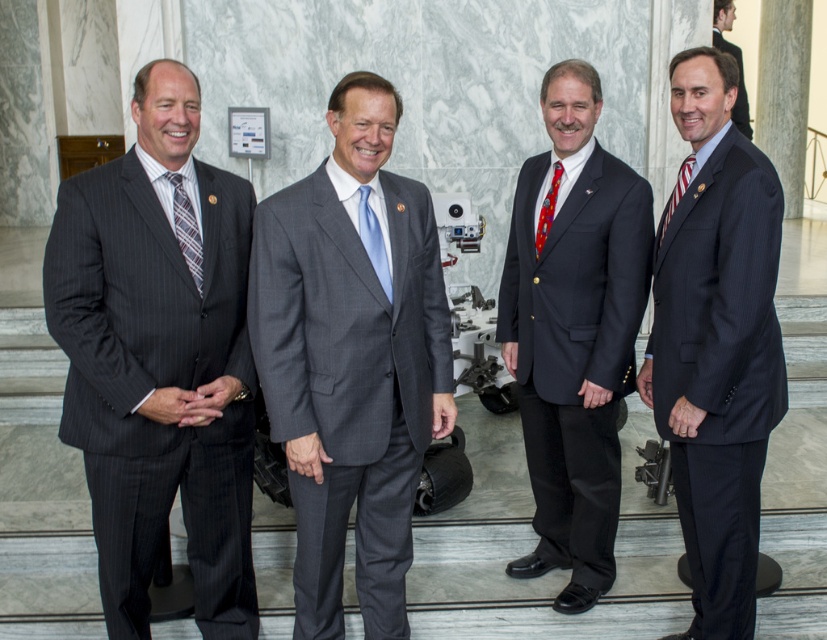
Is gray pinstripe suit at center smaller than light blue silk tie at center?

Incorrect, gray pinstripe suit at center is not smaller in size than light blue silk tie at center.

Is gray pinstripe suit at center positioned in front of light blue silk tie at center?

That is True.

Locate an element on the screen. gray pinstripe suit at center is located at coordinates (349, 384).

Is plaid silk tie at left smaller than matte black suit at center?

Correct, plaid silk tie at left occupies less space than matte black suit at center.

Is plaid silk tie at left thinner than matte black suit at center?

Yes.

What do you see at coordinates (185, 228) in the screenshot?
I see `plaid silk tie at left` at bounding box center [185, 228].

Find the location of a particular element. This screenshot has height=640, width=827. plaid silk tie at left is located at coordinates (185, 228).

From the picture: Who is shorter, gray pinstripe suit at center or matte red tie at right?

matte red tie at right is shorter.

Does point (300, 595) come behind point (672, 198)?

That is False.

Between point (256, 332) and point (692, 160), which one is positioned behind?

The point (692, 160) is more distant.

The height and width of the screenshot is (640, 827). I want to click on gray pinstripe suit at center, so [x=349, y=384].